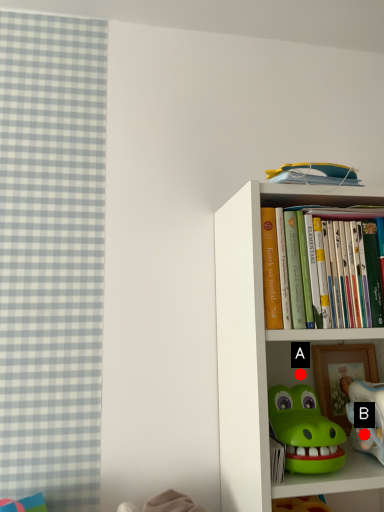
Question: Two points are circled on the image, labeled by A and B beside each circle. Which point appears farthest from the camera in this image?

Choices:
 (A) A is further
 (B) B is further

Answer: (A)